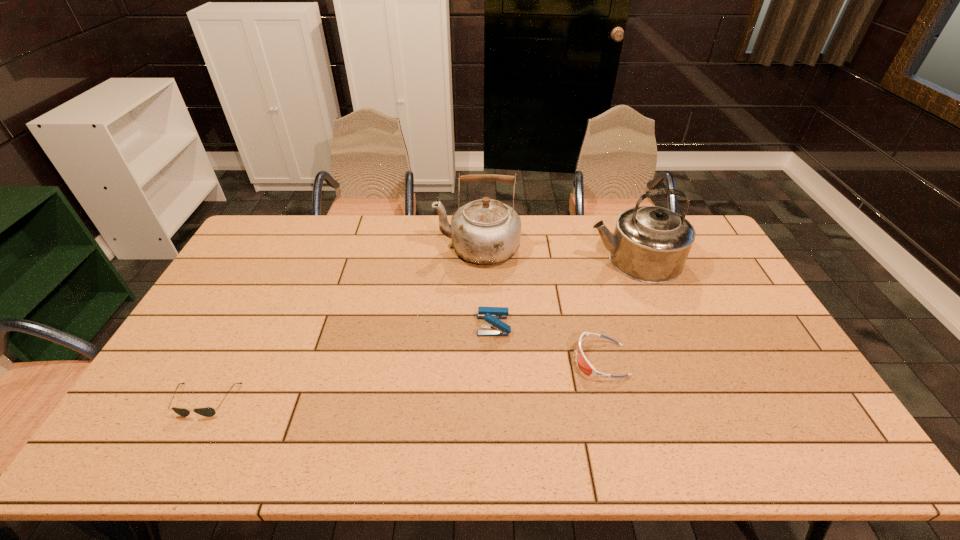
I want to click on the left kettle, so tap(485, 232).

Locate an element on the screen. The image size is (960, 540). the right kettle is located at coordinates (650, 244).

You are a GUI agent. You are given a task and a screenshot of the screen. Output one action in this format:
    pyautogui.click(x=<x>, y=<y>)
    Task: Click on the third nearest object
    
    Given the screenshot: What is the action you would take?
    pyautogui.click(x=491, y=315)

This screenshot has width=960, height=540. What are the coordinates of `the third tallest object` in the screenshot? It's located at tap(491, 315).

This screenshot has width=960, height=540. What are the coordinates of `the fourth farthest object` in the screenshot? It's located at (585, 366).

Where is `the fourth tallest object`? The width and height of the screenshot is (960, 540). the fourth tallest object is located at coordinates (585, 366).

Locate an element on the screen. The image size is (960, 540). the leftmost object is located at coordinates point(207,412).

Identify the location of the nearest object. (207, 412).

What are the coordinates of `vacant space located 0.120m at the spout of the left kettle` in the screenshot? It's located at (401, 248).

Locate an element on the screen. vacant point located 0.210m at the spout of the left kettle is located at coordinates (376, 248).